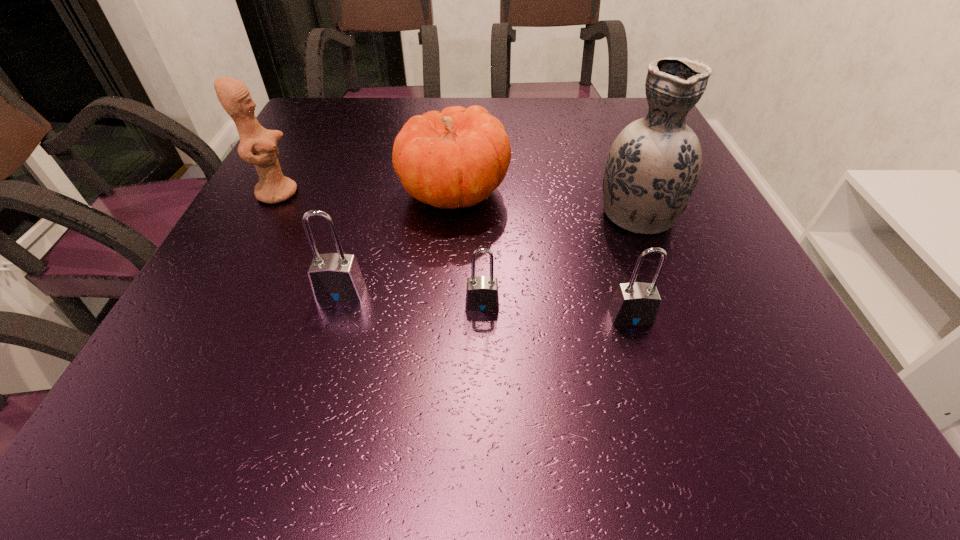
Considering the uniform spacing of padlocks, where should an additional padlock be positioned on the right? Please locate a free spot. Please provide its 2D coordinates. Your answer should be formatted as a tuple, i.e. [(x, y)], where the tuple contains the x and y coordinates of a point satisfying the conditions above.

[(787, 329)]